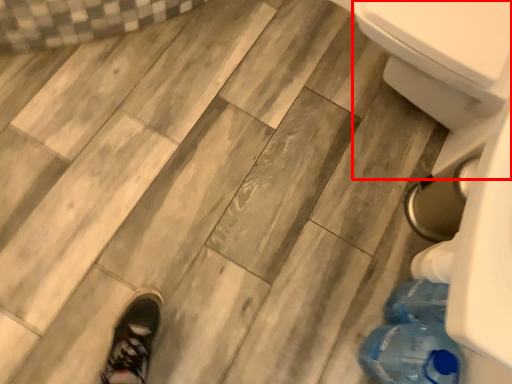
Question: Observing the image, what is the correct spatial positioning of bidet (annotated by the red box) in reference to bottle?

Choices:
 (A) left
 (B) right

Answer: (B)